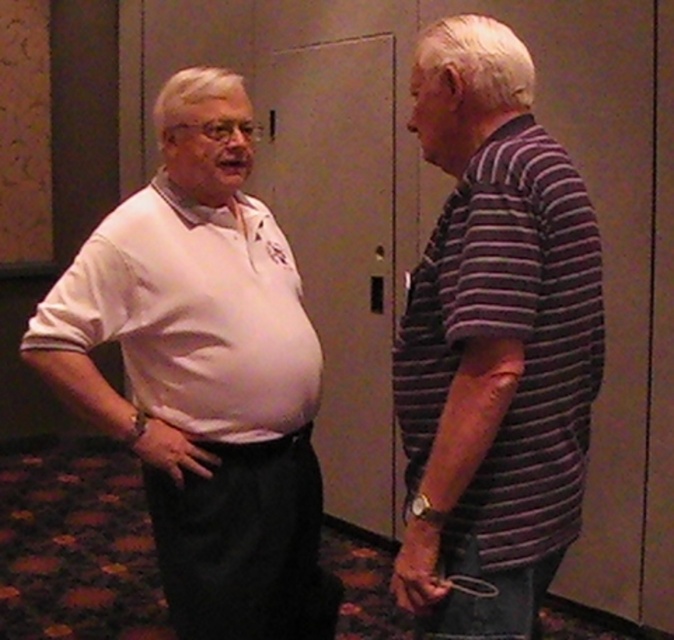
Question: Which of the following is the closest to the observer?

Choices:
 (A) (274, 490)
 (B) (532, 364)

Answer: (B)

Question: Does white matte shirt at left come behind white matte polo shirt at left?

Choices:
 (A) no
 (B) yes

Answer: (A)

Question: Among these points, which one is farthest from the camera?

Choices:
 (A) (187, 216)
 (B) (168, 298)
 (C) (528, 442)

Answer: (A)

Question: Is the position of striped cotton shirt at right less distant than that of white matte polo shirt at left?

Choices:
 (A) no
 (B) yes

Answer: (B)

Question: Among these objects, which one is nearest to the camera?

Choices:
 (A) striped cotton shirt at right
 (B) white matte polo shirt at left

Answer: (A)

Question: Considering the relative positions of white matte shirt at left and white matte polo shirt at left in the image provided, where is white matte shirt at left located with respect to white matte polo shirt at left?

Choices:
 (A) below
 (B) above

Answer: (A)